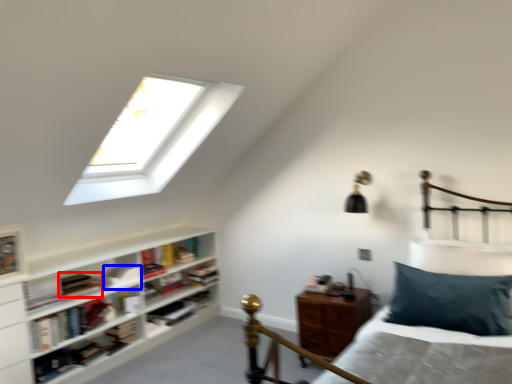
Question: Among these objects, which one is farthest to the camera, book (highlighted by a red box) or book (highlighted by a blue box)?

Choices:
 (A) book
 (B) book

Answer: (B)